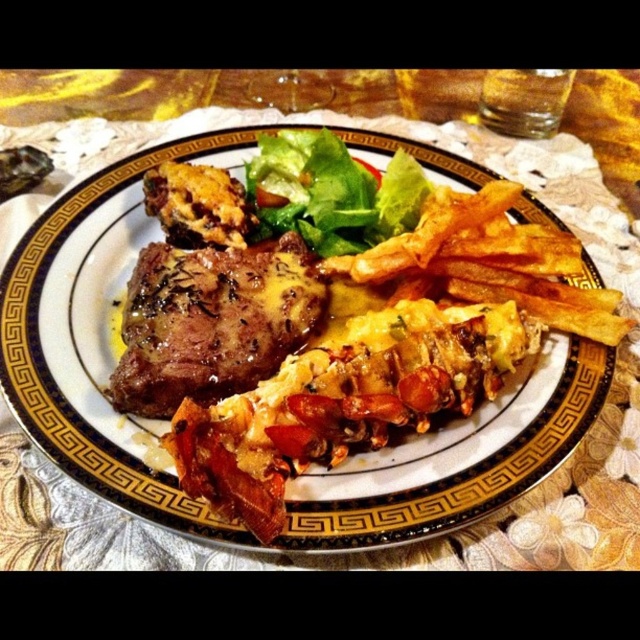
Which is above, savory brown steak at upper left or green leafy lettuce at center?

green leafy lettuce at center

Does point (272, 291) lie in front of point (422, 189)?

Yes, point (272, 291) is closer to viewer.

Is point (128, 400) in front of point (317, 160)?

Yes, point (128, 400) is closer to viewer.

Identify the location of savory brown steak at upper left. pyautogui.click(x=211, y=323).

Is golden-brown crispy fries at upper right shorter than savory brown steak at upper left?

Incorrect, golden-brown crispy fries at upper right's height does not fall short of savory brown steak at upper left's.

Identify the location of golden-brown crispy fries at upper right. The height and width of the screenshot is (640, 640). (164, 422).

Can you confirm if golden-brown crispy fries at upper right is thinner than green leafy lettuce at center?

No, golden-brown crispy fries at upper right is not thinner than green leafy lettuce at center.

Can you confirm if golden-brown crispy fries at upper right is positioned above green leafy lettuce at center?

Incorrect, golden-brown crispy fries at upper right is not positioned above green leafy lettuce at center.

Which is in front, point (584, 259) or point (253, 236)?

Point (584, 259)

Locate an element on the screen. This screenshot has height=640, width=640. golden-brown crispy fries at upper right is located at coordinates (164, 422).